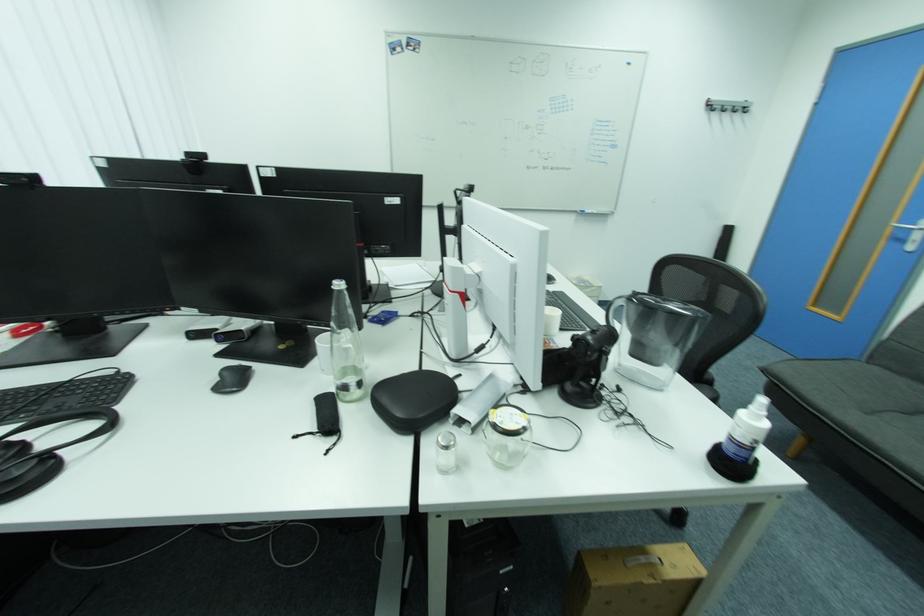
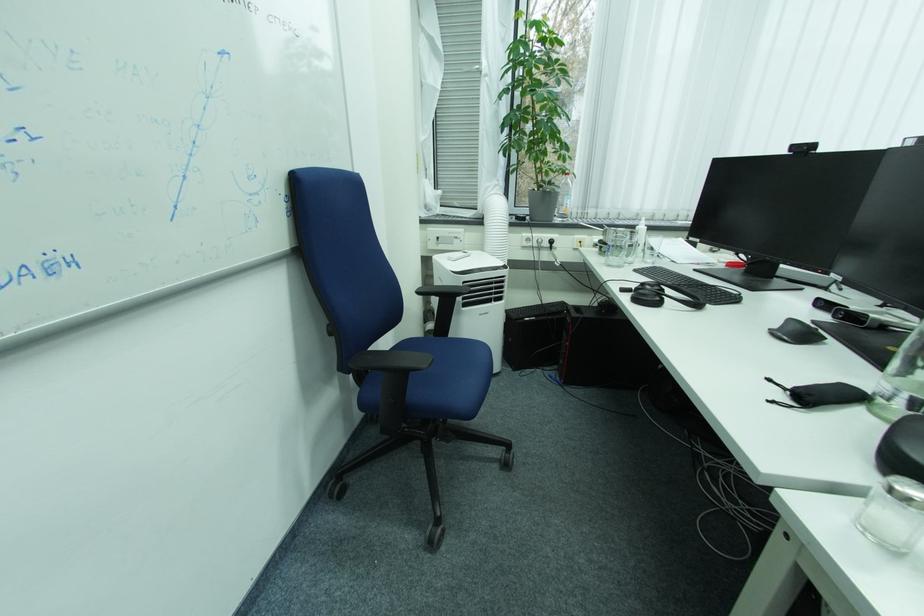
Locate, in the second image, the point that corresponds to (x=224, y=331) in the first image.

(854, 309)